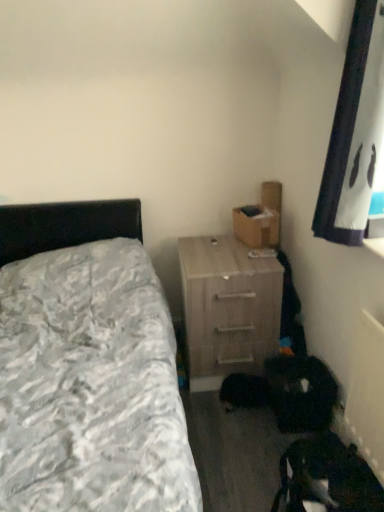
Question: Is light wood/texture nightstand at center-right inside or outside of textured gray bedspread at left?

Choices:
 (A) inside
 (B) outside

Answer: (B)

Question: Based on their positions, is light wood/texture nightstand at center-right located to the left or right of textured gray bedspread at left?

Choices:
 (A) left
 (B) right

Answer: (B)

Question: Considering the real-world distances, which object is closest to the brown cardboard box at upper right?

Choices:
 (A) textured gray bedspread at left
 (B) light wood/texture nightstand at center-right

Answer: (B)

Question: Based on their relative distances, which object is farther from the brown cardboard box at upper right?

Choices:
 (A) light wood/texture nightstand at center-right
 (B) textured gray bedspread at left

Answer: (B)